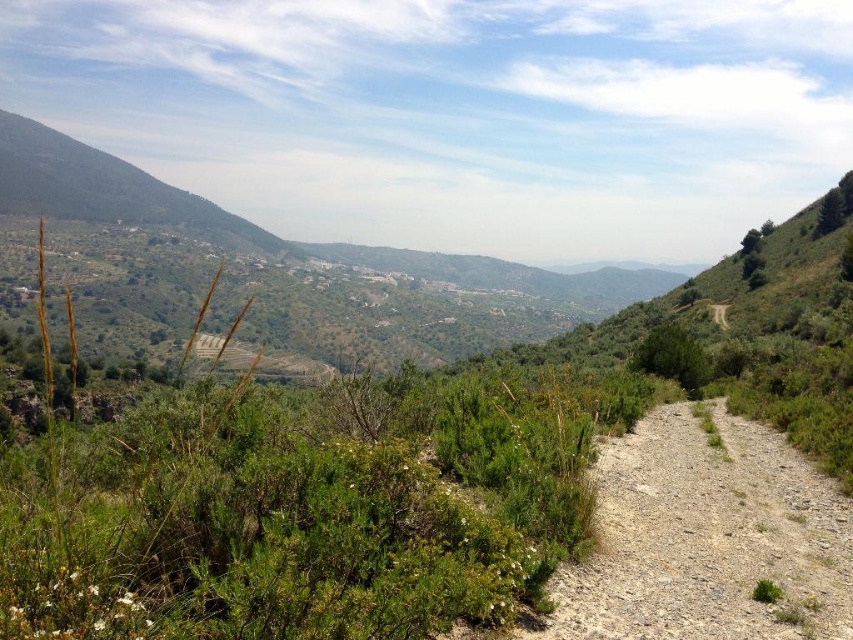
Which of these two, gray gravel path at center-right or dirt/gravel path at center-right, stands shorter?

Standing shorter between the two is gray gravel path at center-right.

Which is more to the left, gray gravel path at center-right or dirt/gravel path at center-right?

gray gravel path at center-right is more to the left.

Between point (666, 604) and point (723, 323), which one is positioned behind?

Point (723, 323)

Identify the location of gray gravel path at center-right. click(706, 538).